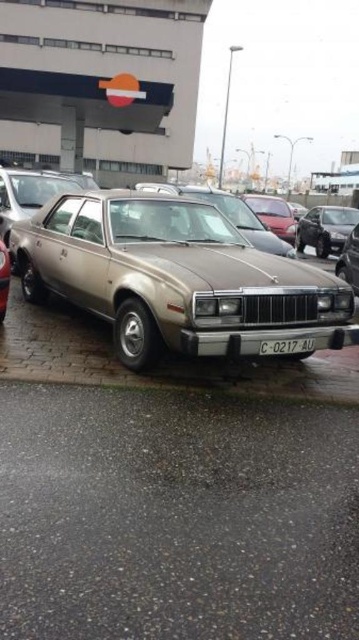
The width and height of the screenshot is (359, 640). Describe the element at coordinates (174, 444) in the screenshot. I see `metallic gold car at center` at that location.

Find the location of a particular element. The image size is (359, 640). metallic gold car at center is located at coordinates (174, 444).

I want to click on metallic gold car at center, so click(174, 444).

Describe the element at coordinates (174, 444) in the screenshot. The height and width of the screenshot is (640, 359). I see `metallic gold car at center` at that location.

This screenshot has width=359, height=640. I want to click on metallic gold car at center, so 174,444.

What do you see at coordinates (174, 444) in the screenshot? I see `metallic gold car at center` at bounding box center [174, 444].

Locate an element on the screen. The height and width of the screenshot is (640, 359). metallic gold car at center is located at coordinates (174, 444).

Measure the distance between gold metallic sedan at center and camera.

11.00 feet

Looking at this image, does gold metallic sedan at center come behind white plastic license plate at center?

No, it is not.

Locate an element on the screen. This screenshot has height=640, width=359. gold metallic sedan at center is located at coordinates (174, 276).